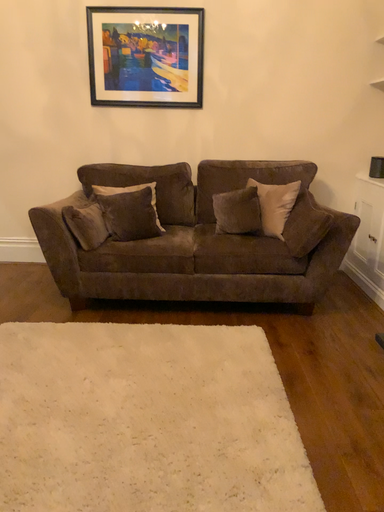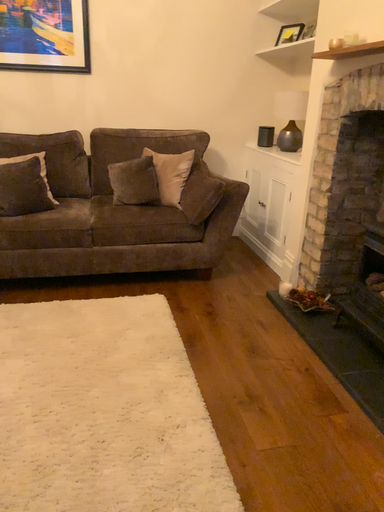
Question: Which way did the camera rotate in the video?

Choices:
 (A) rotated left
 (B) rotated right

Answer: (B)